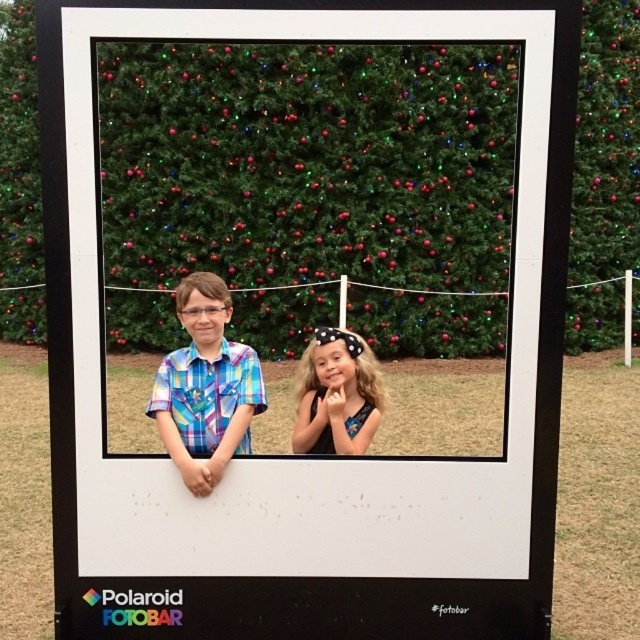
You are a photographer trying to focus on the plaid fabric shirt at center in the image. You notice a point at coordinates [205,387]. Is this point located on the plaid fabric shirt at center?

Yes, the point at coordinates [205,387] is located on the plaid fabric shirt at center according to the description.

You are a photographer reviewing a Polaroid photo and notice two elements at the center of the image. Which one takes up more visual space, the plaid fabric shirt at center or the blonde hair at center?

The plaid fabric shirt at center is larger in size than the blonde hair at center, so it takes up more visual space.

You are a photographer analyzing the Polaroid frame. You notice the plaid fabric shirt at center and the blonde hair at center. Which object is wider in the image?

The plaid fabric shirt at center is wider than the blonde hair at center.